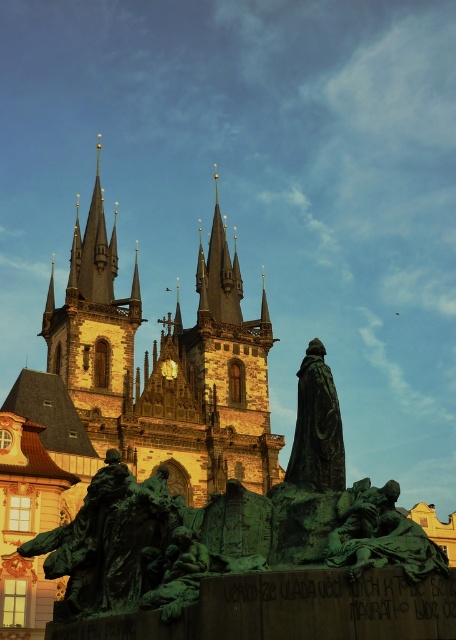
You are a tourist standing at the entrance of the historic church and want to take a photo of the green patinated bronze statue at center. Based on its coordinates, will it be visible in your frame if you point your camera straight ahead?

The green patinated bronze statue at center is located at coordinates point [379,534], which is near the lower right corner of the image. Since you are pointing the camera straight ahead, the statue might be slightly out of the frame unless you adjust your angle to include it.

You are a drone operator who needs to fly a drone from the green patinated bronze statue at center to the polished gold spire at center. The drone has a maximum range of 60 meters. Can the drone reach the spire from the statue?

The green patinated bronze statue at center is 63.59 meters from the polished gold spire at center. Since the drone has a maximum range of 60 meters, it cannot reach the spire from the statue.

You are an architect analyzing the church layout. Which spire, the golden stone spires at upper left or the polished gold spire at center, is located to the right side of the other?

The golden stone spires at upper left is positioned on the left side of polished gold spire at center, so the polished gold spire at center is to the right of the golden stone spires at upper left.